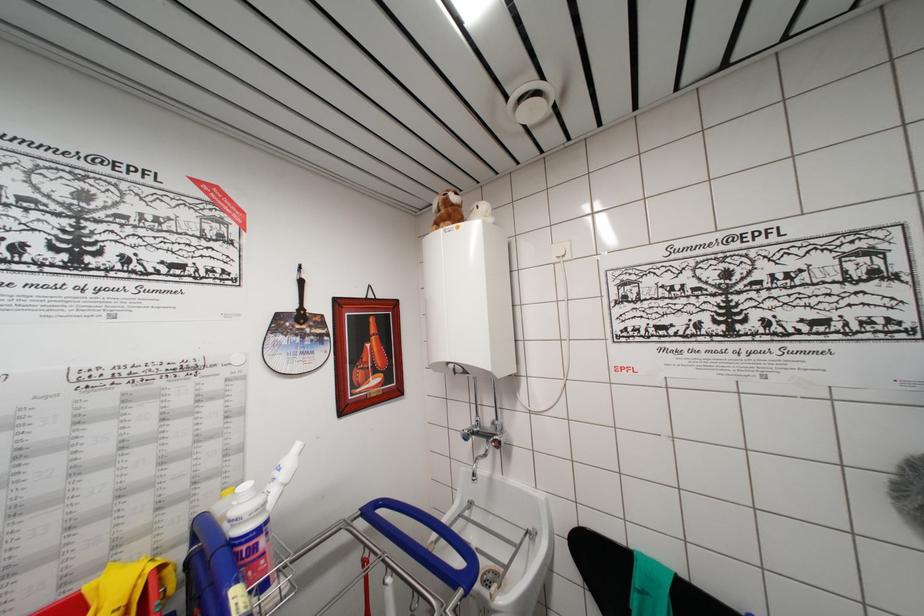
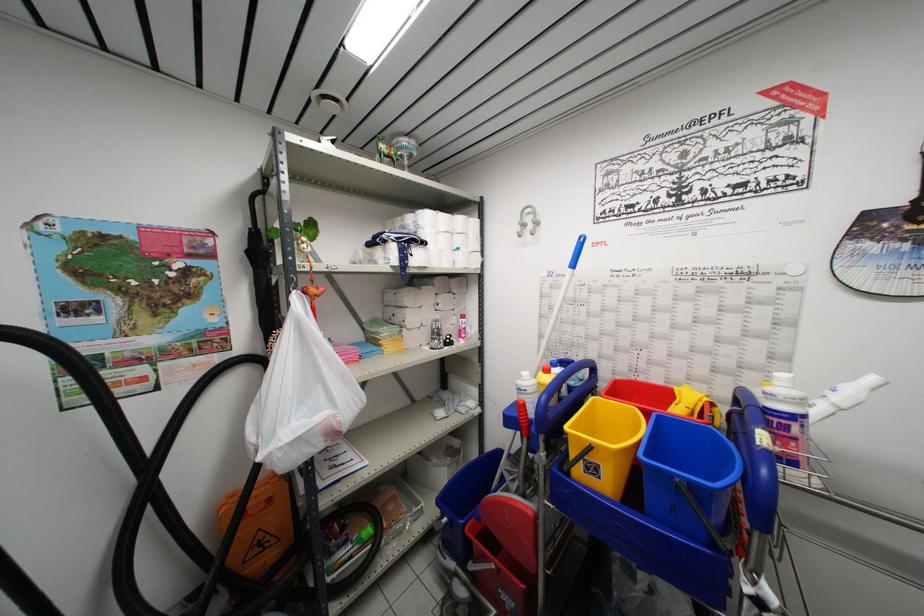
Find the pixel in the second image that matches [165,572] in the first image.

(715, 408)